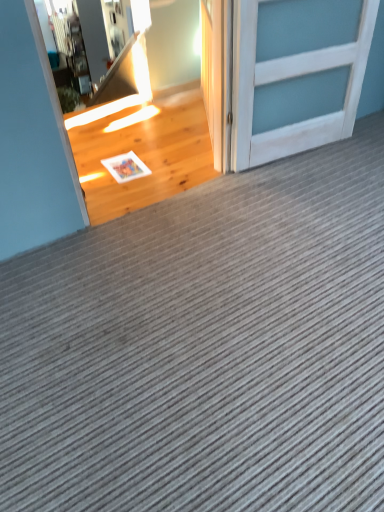
Question: In terms of size, does white wood door at upper right, the second door when ordered from left to right, appear bigger or smaller than white wood door at upper right, placed as the 1th door when sorted from left to right?

Choices:
 (A) big
 (B) small

Answer: (A)

Question: Is white wood door at upper right, the first door when ordered from right to left, wider or thinner than white wood door at upper right, placed as the 2th door when sorted from right to left?

Choices:
 (A) thin
 (B) wide

Answer: (B)

Question: Is white wood door at upper right, the first door when ordered from right to left, inside the boundaries of white wood door at upper right, placed as the 2th door when sorted from right to left, or outside?

Choices:
 (A) outside
 (B) inside

Answer: (A)

Question: Is white wood door at upper right, placed as the 1th door when sorted from left to right, in front of or behind white wood door at upper right, the first door when ordered from right to left, in the image?

Choices:
 (A) behind
 (B) front

Answer: (A)

Question: Considering the positions of white wood door at upper right, placed as the 1th door when sorted from left to right, and white wood door at upper right, the second door when ordered from left to right, in the image, is white wood door at upper right, placed as the 1th door when sorted from left to right, wider or thinner than white wood door at upper right, the second door when ordered from left to right,?

Choices:
 (A) wide
 (B) thin

Answer: (B)

Question: Which is correct: white wood door at upper right, placed as the 2th door when sorted from right to left, is inside white wood door at upper right, the first door when ordered from right to left, or outside of it?

Choices:
 (A) inside
 (B) outside

Answer: (B)

Question: In the image, is white wood door at upper right, placed as the 2th door when sorted from right to left, on the left side or the right side of white wood door at upper right, the first door when ordered from right to left?

Choices:
 (A) right
 (B) left

Answer: (B)